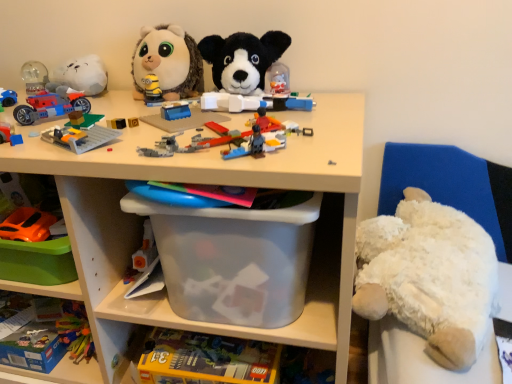
Where is `free space in front of fluffy white plush at upper center, which is counted as the seventh toy, starting from the bottom`? This screenshot has width=512, height=384. free space in front of fluffy white plush at upper center, which is counted as the seventh toy, starting from the bottom is located at coordinates (168, 110).